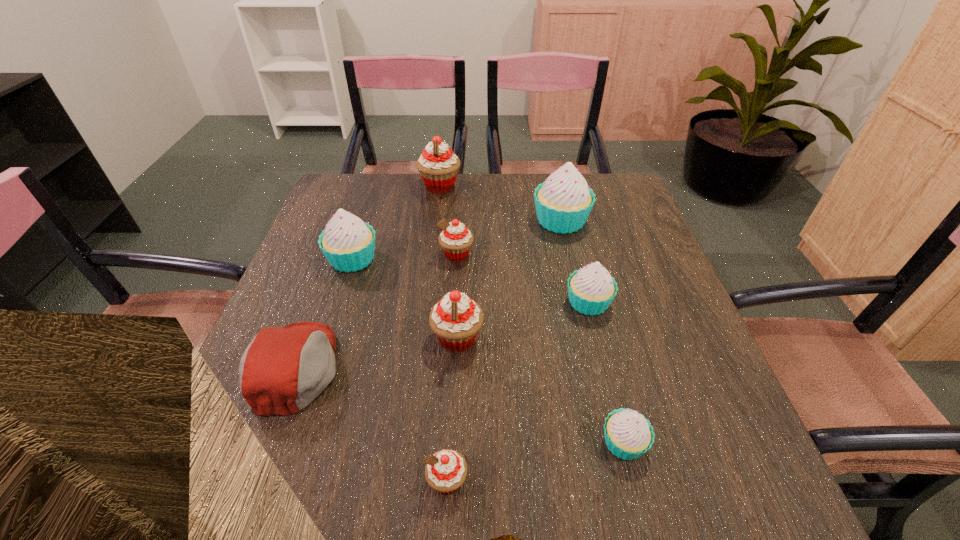
Identify the location of vacant space that satisfies the following two spatial constraints: 1. on the back side of the nearest pink cupcake; 2. on the left side of the smallest white cupcake. The height and width of the screenshot is (540, 960). (449, 443).

Identify the location of free location that satisfies the following two spatial constraints: 1. on the back side of the biggest white cupcake; 2. on the right side of the nearest pink cupcake. (461, 221).